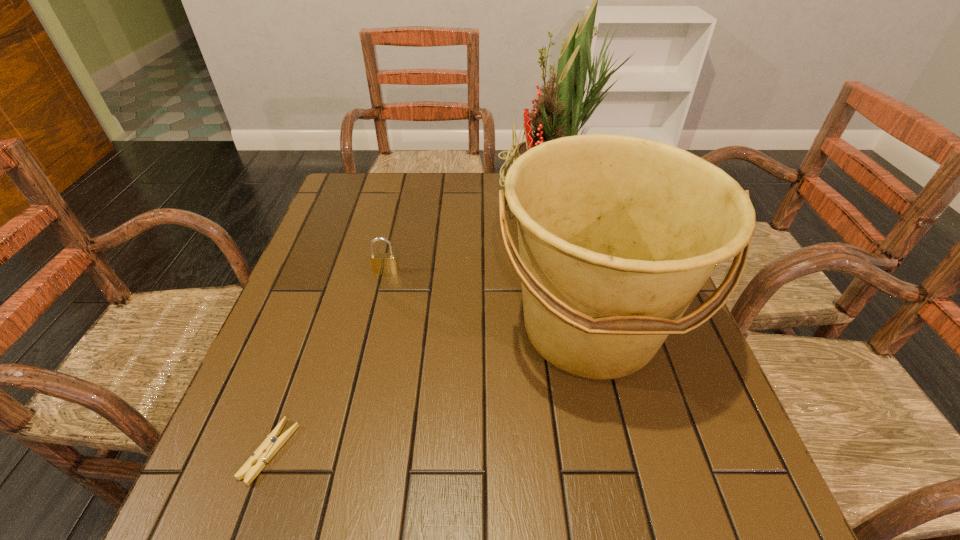
Identify the location of vacant point located on the side of the bucket with the handle. (622, 466).

The width and height of the screenshot is (960, 540). I want to click on vacant space located on the front-facing side of the padlock, so click(x=362, y=374).

Image resolution: width=960 pixels, height=540 pixels. I want to click on vacant space situated 0.340m on the back of the leftmost object, so click(328, 288).

The height and width of the screenshot is (540, 960). Find the location of `object situated at the far edge`. object situated at the far edge is located at coordinates (559, 113).

The width and height of the screenshot is (960, 540). Find the location of `object situated at the near edge`. object situated at the near edge is located at coordinates (254, 465).

The height and width of the screenshot is (540, 960). Identify the location of object positioned at the left edge. (254, 465).

This screenshot has height=540, width=960. Identify the location of flower arrangement positioned at the right edge. (559, 113).

The height and width of the screenshot is (540, 960). I want to click on bucket that is at the right edge, so click(617, 234).

Find the location of a particular element. This screenshot has height=540, width=960. object present at the near left corner is located at coordinates (254, 465).

Locate an element on the screen. This screenshot has width=960, height=540. object situated at the far right corner is located at coordinates (559, 113).